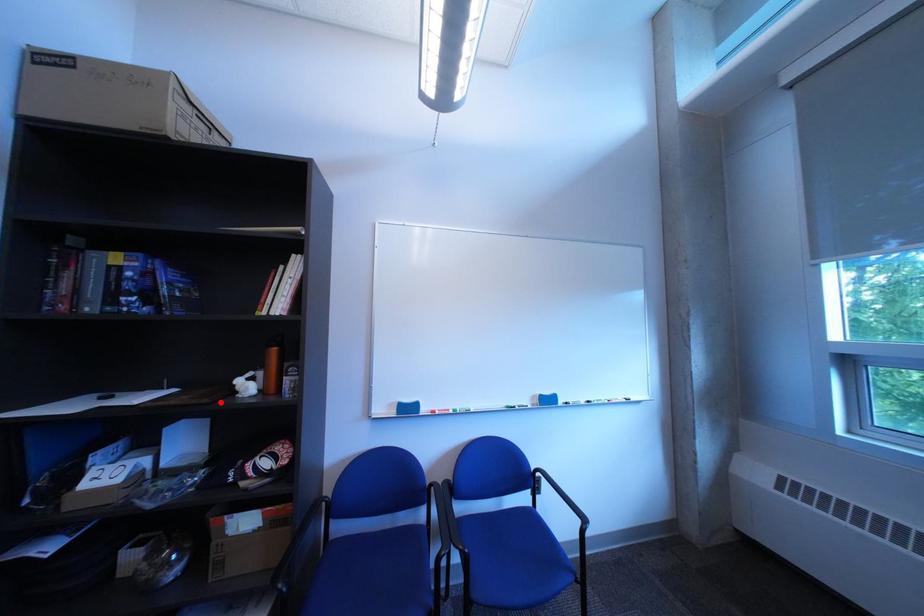
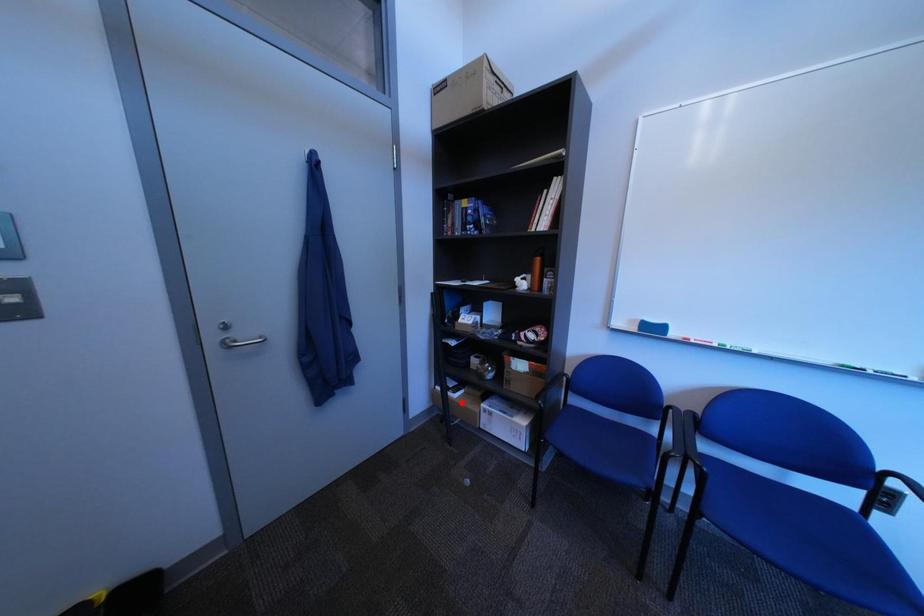
I am providing you with two images of the same scene from different viewpoints. A red point is marked on the first image and another point is marked on the second image. Does the point marked in image1 correspond to the same location as the one in image2?

No